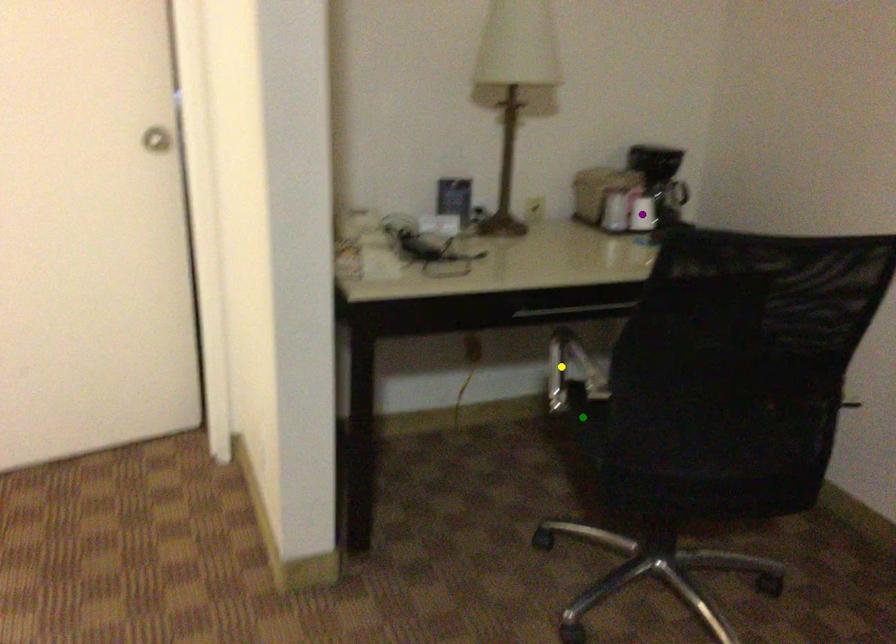
Order these from nearest to farthest:
purple point | green point | yellow point

1. green point
2. purple point
3. yellow point